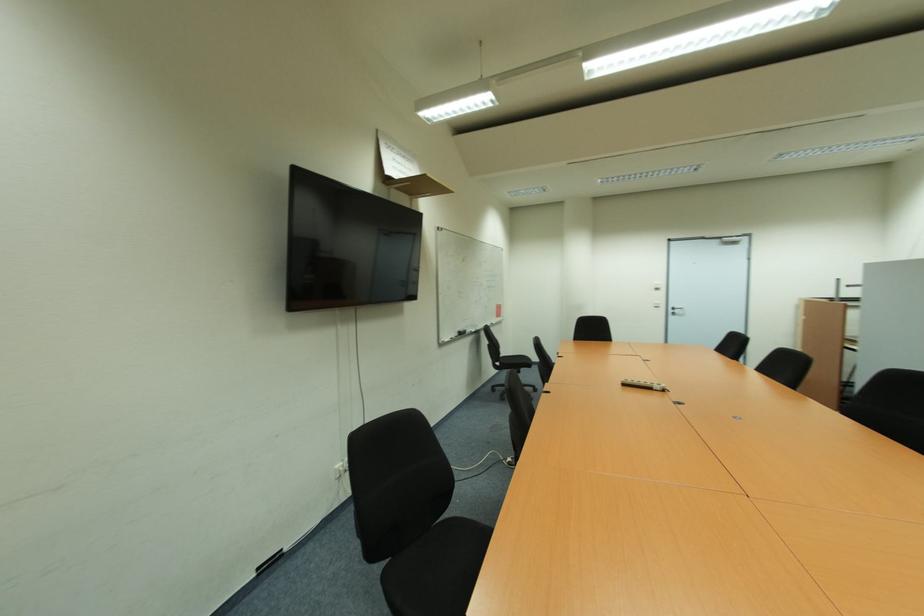
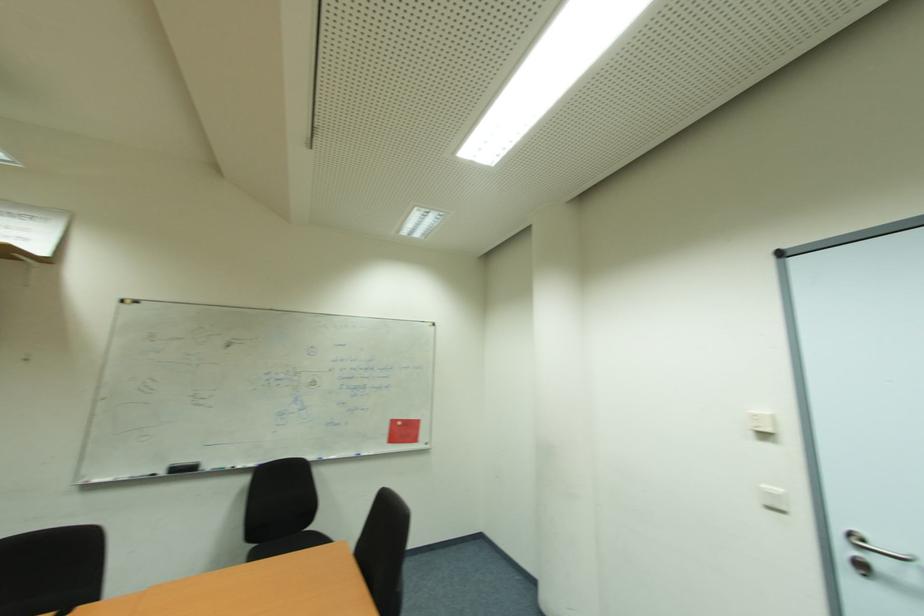
In the second image, find the point that corresponds to point (500, 307) in the first image.

(397, 423)